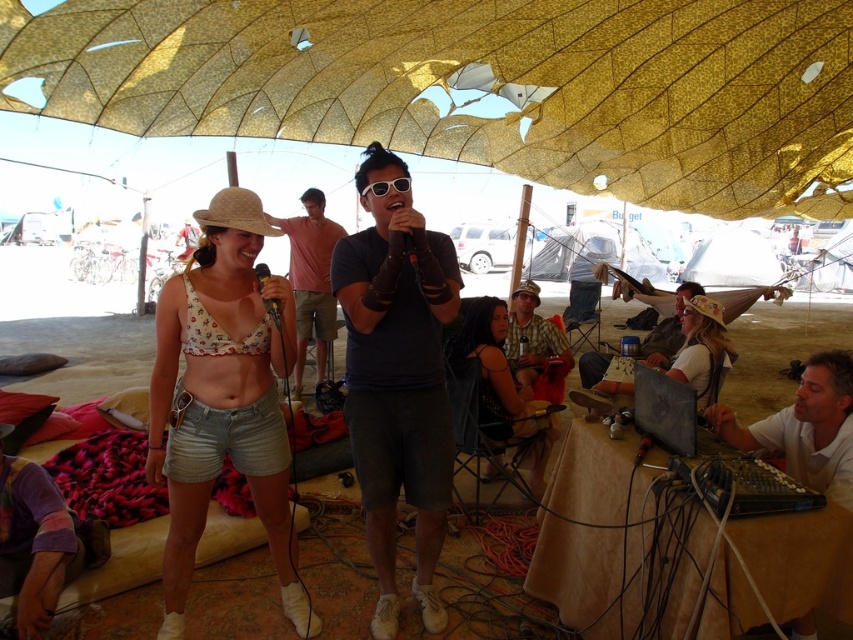
Does white fabric tent at center have a lesser height compared to black matte microphone at center?

Incorrect, white fabric tent at center's height does not fall short of black matte microphone at center's.

From the picture: Does white fabric tent at center appear on the right side of black matte microphone at center?

Correct, you'll find white fabric tent at center to the right of black matte microphone at center.

The width and height of the screenshot is (853, 640). In order to click on white fabric tent at center in this screenshot , I will do `click(733, 260)`.

Which is above, matte brown hat at right or camouflage fabric shirt at center?

camouflage fabric shirt at center is above.

Does matte brown hat at right appear on the right side of camouflage fabric shirt at center?

Indeed, matte brown hat at right is positioned on the right side of camouflage fabric shirt at center.

Is point (717, 321) farther from viewer compared to point (560, 380)?

No, it is in front of (560, 380).

What are the coordinates of `matte brown hat at right` in the screenshot? It's located at (698, 349).

Is point (418, 268) farther from viewer compared to point (646, 276)?

No.

Is point (425, 436) in front of point (567, 262)?

That is True.

Between point (358, 257) and point (665, 275), which one is positioned in front?

Point (358, 257) is in front.

You are a GUI agent. You are given a task and a screenshot of the screen. Output one action in this format:
    pyautogui.click(x=<x>, y=<y>)
    Task: Click on the dark blue t-shirt at center
    The height and width of the screenshot is (640, 853).
    Given the screenshot: What is the action you would take?
    pyautogui.click(x=397, y=378)